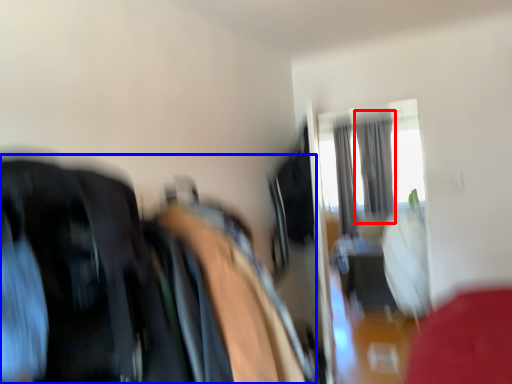
Question: Which object appears closest to the camera in this image, curtain (highlighted by a red box) or laundry (highlighted by a blue box)?

Choices:
 (A) curtain
 (B) laundry

Answer: (B)